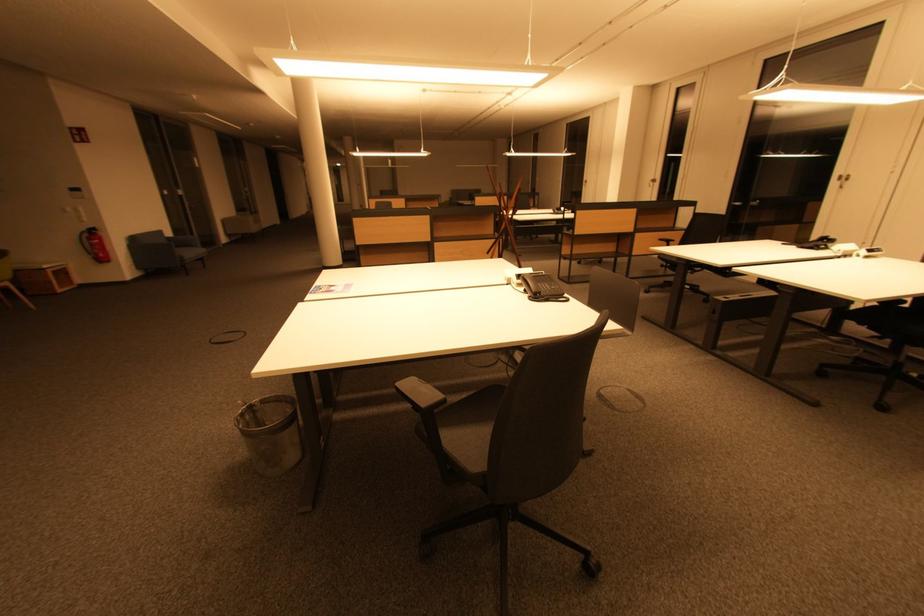
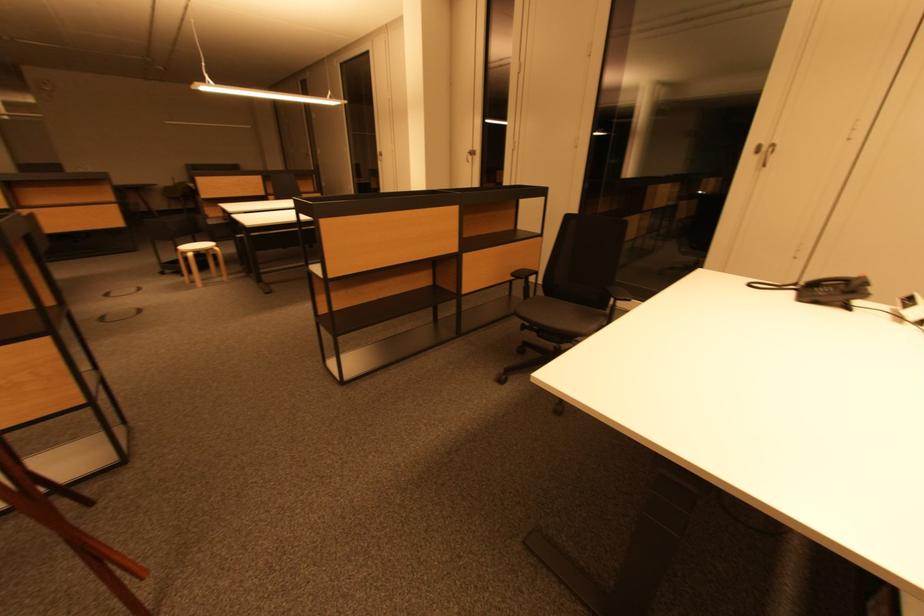
The point at (x=641, y=237) is marked in the first image. Where is the corresponding point in the second image?

(470, 259)